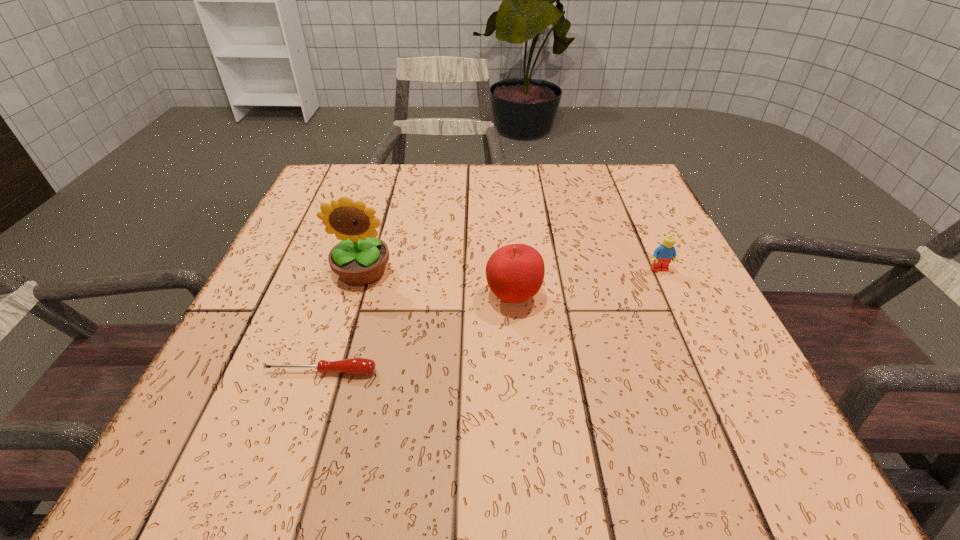
I want to click on free space located 0.060m on the front of the screwdriver, so click(x=309, y=411).

Locate an element on the screen. This screenshot has height=540, width=960. sunflower positioned at the left edge is located at coordinates (360, 259).

Find the location of a particular element. This screenshot has height=540, width=960. screwdriver that is at the left edge is located at coordinates (355, 366).

The height and width of the screenshot is (540, 960). Identify the location of object at the right edge. (666, 252).

Identify the location of vacant area at the far edge of the desktop. [541, 205].

At what (x,y) coordinates should I click in order to perform the action: click on vacant area at the near edge. Please return your answer as a coordinate pair (x, y). Looking at the image, I should click on (421, 475).

The width and height of the screenshot is (960, 540). In the image, there is a desktop. Identify the location of vacant space at the left edge. (271, 294).

This screenshot has width=960, height=540. I want to click on vacant point at the right edge, so click(x=678, y=282).

In the image, there is a desktop. Identify the location of free space at the far left corner. This screenshot has height=540, width=960. (305, 201).

I want to click on free spot at the far right corner of the desktop, so click(x=607, y=210).